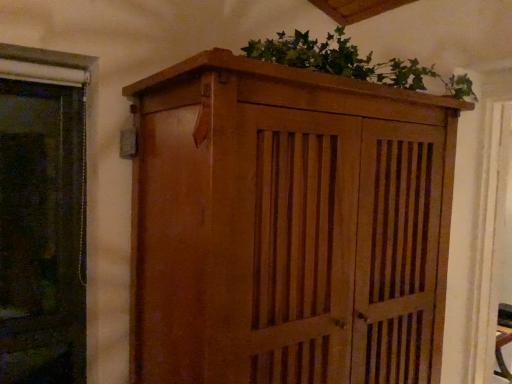
Question: Is green leafy plant at upper center situated inside wooden cabinet at center or outside?

Choices:
 (A) outside
 (B) inside

Answer: (A)

Question: Is green leafy plant at upper center wider or thinner than wooden cabinet at center?

Choices:
 (A) wide
 (B) thin

Answer: (B)

Question: Considering their positions, is green leafy plant at upper center located in front of or behind wooden cabinet at center?

Choices:
 (A) behind
 (B) front

Answer: (A)

Question: Is wooden cabinet at center spatially inside green leafy plant at upper center, or outside of it?

Choices:
 (A) outside
 (B) inside

Answer: (A)

Question: In terms of size, does wooden cabinet at center appear bigger or smaller than green leafy plant at upper center?

Choices:
 (A) small
 (B) big

Answer: (B)

Question: From a real-world perspective, relative to green leafy plant at upper center, is wooden cabinet at center vertically above or below?

Choices:
 (A) above
 (B) below

Answer: (B)

Question: Is wooden cabinet at center taller or shorter than green leafy plant at upper center?

Choices:
 (A) tall
 (B) short

Answer: (A)